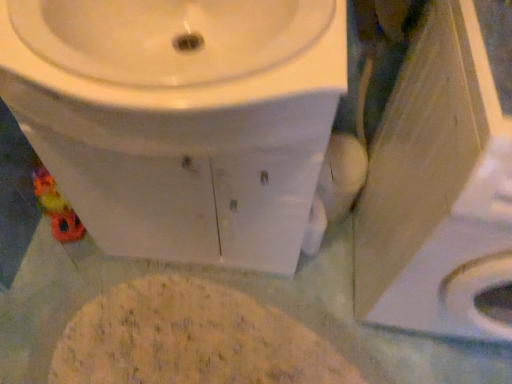
The image size is (512, 384). In order to click on blank space situated above yellowish powder at center (from a real-world perspective) in this screenshot , I will do `click(232, 331)`.